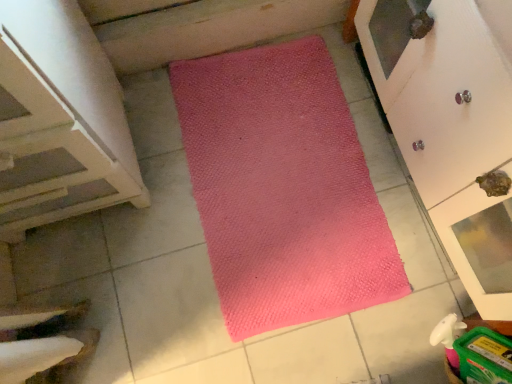
Question: From a real-world perspective, is pink textured mat at center positioned over matte white cupboard at upper right based on gravity?

Choices:
 (A) no
 (B) yes

Answer: (A)

Question: Is pink textured mat at center outside matte white cupboard at upper right?

Choices:
 (A) yes
 (B) no

Answer: (A)

Question: Is matte white cupboard at upper right at the back of pink textured mat at center?

Choices:
 (A) yes
 (B) no

Answer: (B)

Question: Is pink textured mat at center bigger than matte white cupboard at upper right?

Choices:
 (A) yes
 (B) no

Answer: (B)

Question: Would you say pink textured mat at center is a long distance from matte white cupboard at upper right?

Choices:
 (A) yes
 (B) no

Answer: (B)

Question: Considering the relative positions of pink textured mat at center and matte white cupboard at upper right in the image provided, is pink textured mat at center to the left or to the right of matte white cupboard at upper right?

Choices:
 (A) left
 (B) right

Answer: (A)

Question: From a real-world perspective, is pink textured mat at center above or below matte white cupboard at upper right?

Choices:
 (A) below
 (B) above

Answer: (A)

Question: Is pink textured mat at center taller or shorter than matte white cupboard at upper right?

Choices:
 (A) tall
 (B) short

Answer: (B)

Question: Is pink textured mat at center wider or thinner than matte white cupboard at upper right?

Choices:
 (A) thin
 (B) wide

Answer: (B)

Question: Based on their sizes in the image, would you say matte white cupboard at upper right is bigger or smaller than pink textured mat at center?

Choices:
 (A) small
 (B) big

Answer: (B)

Question: From a real-world perspective, is matte white cupboard at upper right positioned above or below pink textured mat at center?

Choices:
 (A) below
 (B) above

Answer: (B)

Question: Does point (448, 34) appear closer or farther from the camera than point (266, 236)?

Choices:
 (A) farther
 (B) closer

Answer: (B)

Question: From the image's perspective, relative to pink textured mat at center, is matte white cupboard at upper right above or below?

Choices:
 (A) above
 (B) below

Answer: (A)

Question: From the image's perspective, is matte white cupboard at upper right above or below white wood stairs at left?

Choices:
 (A) below
 (B) above

Answer: (A)

Question: Would you say matte white cupboard at upper right is to the left or to the right of white wood stairs at left in the picture?

Choices:
 (A) left
 (B) right

Answer: (B)